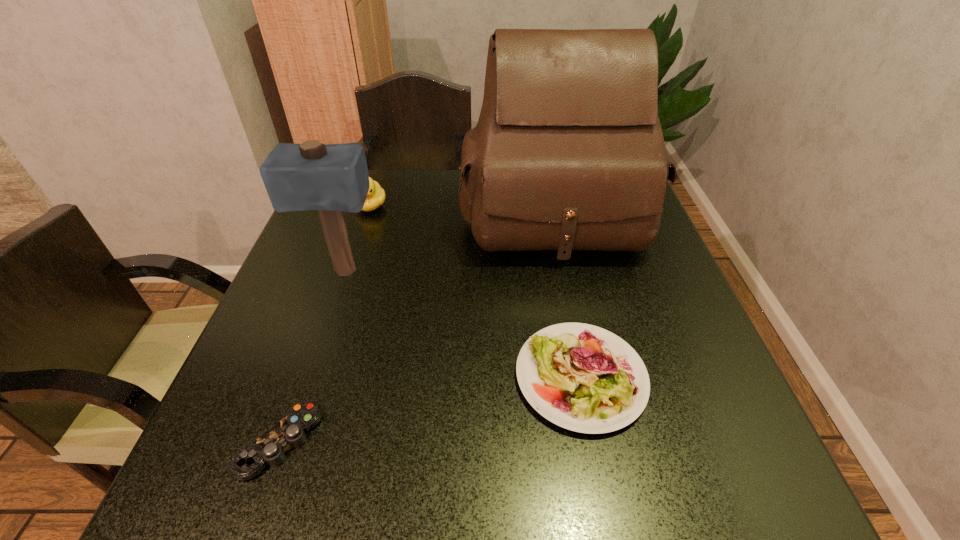
The width and height of the screenshot is (960, 540). Identify the location of the tallest object. (568, 153).

Where is `the fourth shortest object`? The image size is (960, 540). the fourth shortest object is located at coordinates (x=331, y=178).

You are a GUI agent. You are given a task and a screenshot of the screen. Output one action in this format:
    pyautogui.click(x=<x>, y=<y>)
    Task: Click on the third tallest object
    This screenshot has width=960, height=540.
    Given the screenshot: What is the action you would take?
    pyautogui.click(x=375, y=198)

Identify the location of salad plate. (581, 377).

The height and width of the screenshot is (540, 960). I want to click on the shortest object, so click(270, 448).

You are a GUI agent. You are given a task and a screenshot of the screen. Output one action in this format:
    pyautogui.click(x=<x>, y=<y>)
    Task: Click on the vacant space situated 0.060m on the front flap of the satchel
    The height and width of the screenshot is (540, 960).
    Given the screenshot: What is the action you would take?
    pyautogui.click(x=568, y=285)

Locate an element on the screen. The width and height of the screenshot is (960, 540). free space located on the front of the fourth shortest object is located at coordinates (313, 367).

This screenshot has width=960, height=540. I want to click on free space located 0.340m on the beak of the third shortest object, so click(x=338, y=310).

Locate an element on the screen. vacant area situated on the left of the second shortest object is located at coordinates (351, 377).

The image size is (960, 540). Find the location of `vacant space situated on the right of the control`. vacant space situated on the right of the control is located at coordinates (357, 441).